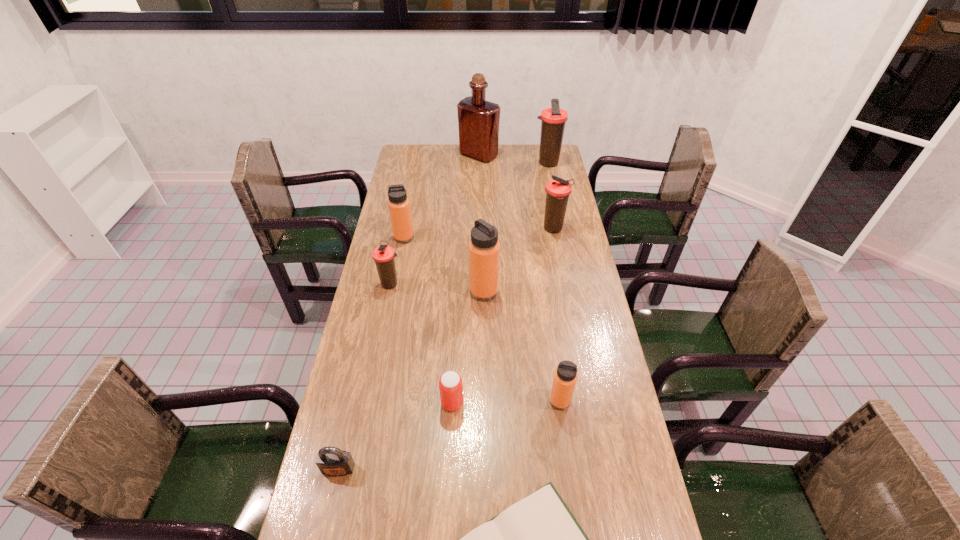
Where is `the smallest brown thermos bottle`? Image resolution: width=960 pixels, height=540 pixels. the smallest brown thermos bottle is located at coordinates (383, 255).

You are a GUI agent. You are given a task and a screenshot of the screen. Output one action in this format:
    pyautogui.click(x=<x>, y=<y>)
    Task: Click on the nearest thermos bottle
    Image resolution: width=960 pixels, height=540 pixels.
    Given the screenshot: What is the action you would take?
    pyautogui.click(x=565, y=376)

Identify the location of the nearest orange thermos bottle. (565, 376).

Identify the location of beer can. (450, 383).

What are the coordinates of `padlock` in the screenshot? It's located at (332, 461).

You are a GUI agent. You are given a task and a screenshot of the screen. Output one action in this format:
    pyautogui.click(x=<x>, y=<y>)
    Task: Click on the gray padlock
    This screenshot has height=540, width=960.
    Given the screenshot: What is the action you would take?
    pyautogui.click(x=332, y=461)

Find the location of `vacant space located 0.090m on the front of the tallest object`. vacant space located 0.090m on the front of the tallest object is located at coordinates (479, 174).

Where is `vacant space situated 0.140m on the front of the farthest thermos bottle`? The width and height of the screenshot is (960, 540). vacant space situated 0.140m on the front of the farthest thermos bottle is located at coordinates (552, 187).

Image resolution: width=960 pixels, height=540 pixels. In order to click on vacant area situated 0.240m on the back of the second orange thermos bottle from right to left in this screenshot , I will do point(484,238).

I want to click on free region located 0.260m on the front of the second smallest brown thermos bottle, so pyautogui.click(x=564, y=285).